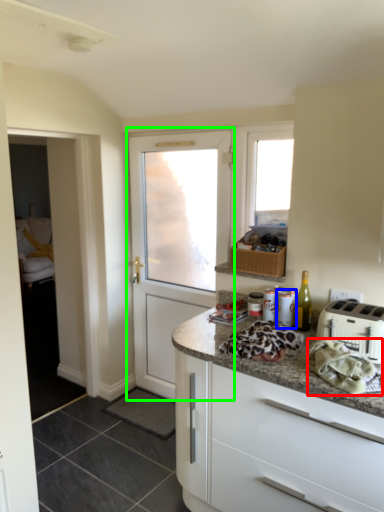
Question: Which object is positioned farthest from material (highlighted by a red box)? Select from appliance (highlighted by a blue box) and door (highlighted by a green box).

Choices:
 (A) appliance
 (B) door

Answer: (B)